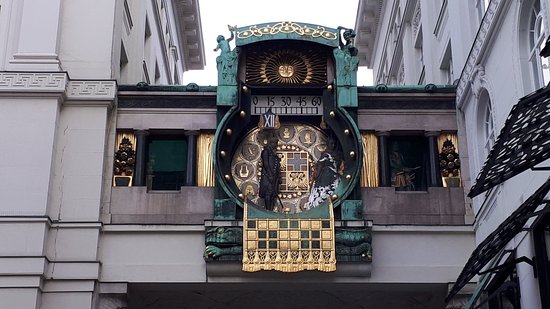
This screenshot has height=309, width=550. In order to click on wall in this screenshot , I will do `click(29, 142)`.